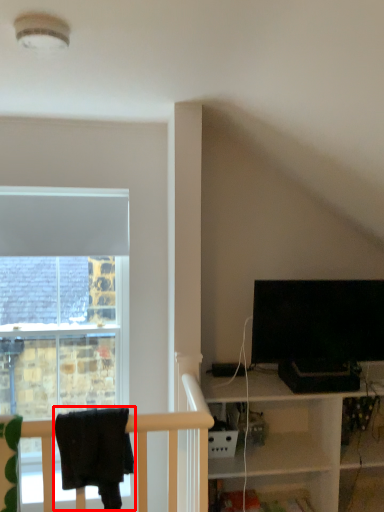
Question: From the image, what is the correct spatial relationship of laundry (annotated by the red box) in relation to television?

Choices:
 (A) left
 (B) right

Answer: (A)